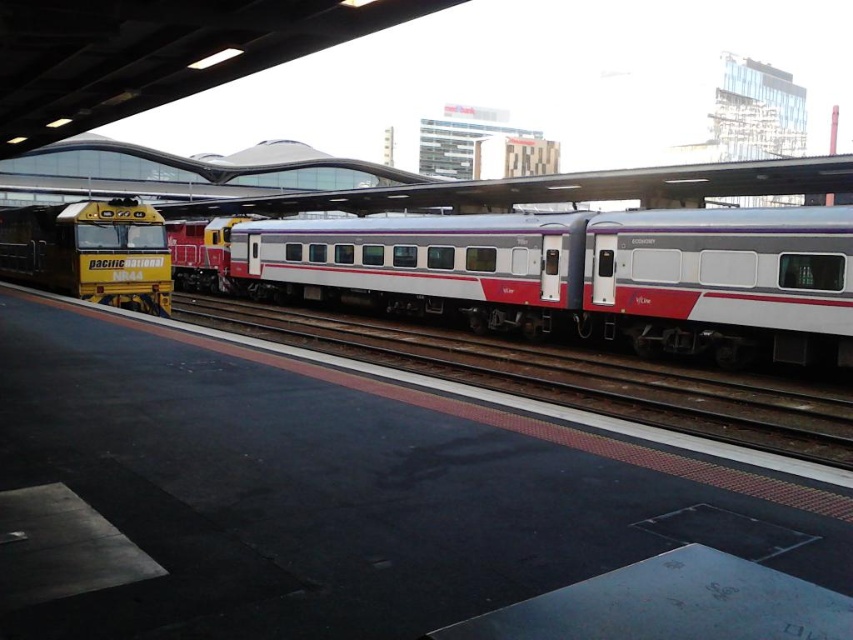
You are standing on the platform at the train station. There is a point marked at coordinate (579, 275). What object is located at that point?

The point at coordinate (579, 275) corresponds to the silver metallic train car at center.

You are a passenger waiting on the platform and see the silver metallic train car at center and the yellow painted metal locomotive at left. Which one is closer to the edge of the platform?

The silver metallic train car at center is closer to the edge of the platform because it is located below the yellow painted metal locomotive at left, implying it is positioned further forward on the track towards the platform edge.

You are standing on the train station platform and want to board the silver metallic train car at center. Which direction should you walk to reach it from the yellow painted metal locomotive at left?

The silver metallic train car at center is closer to the viewer than the yellow painted metal locomotive at left, so you should walk towards the silver metallic train car at center in the direction away from the yellow painted metal locomotive at left.